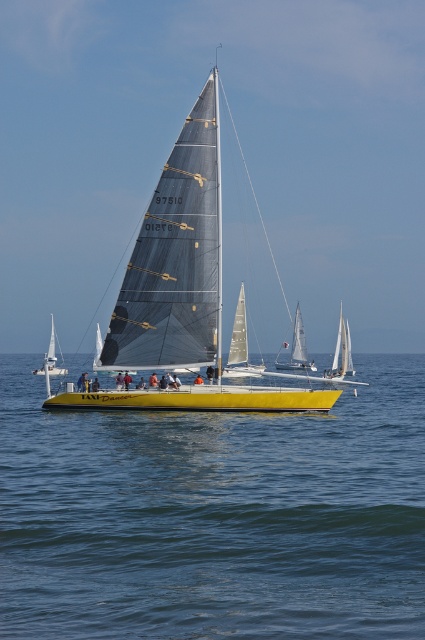
Question: Estimate the real-world distances between objects in this image. Which object is farther from the white matte sailboat at lower left?

Choices:
 (A) clear blue water at center
 (B) yellow matte sailboat at center

Answer: (B)

Question: Which object appears farthest from the camera in this image?

Choices:
 (A) white sail at center
 (B) yellow matte sailboat at center
 (C) white matte sailboat at lower left
 (D) clear blue water at center

Answer: (A)

Question: Can you confirm if white sail at center is bigger than white matte sailboat at lower left?

Choices:
 (A) no
 (B) yes

Answer: (A)

Question: Is white sail at center wider than white matte sailboat at lower left?

Choices:
 (A) yes
 (B) no

Answer: (B)

Question: Based on their relative distances, which object is nearer to the white sail at center?

Choices:
 (A) clear blue water at center
 (B) yellow matte sailboat at center
 (C) white matte sailboat at lower left

Answer: (C)

Question: In this image, where is clear blue water at center located relative to white matte sailboat at lower left?

Choices:
 (A) above
 (B) below

Answer: (B)